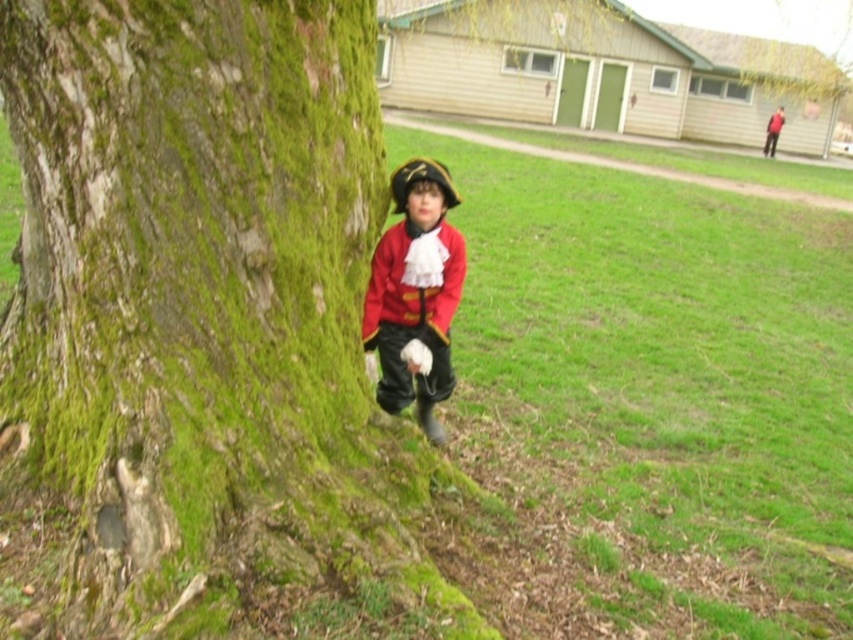
Based on the scene, which object is larger in size between the green mossy bark at left and the matte red coat at center?

The green mossy bark at left is bigger than the matte red coat at center.

You are a fashion designer observing the child in the image. You notice two red items of clothing at the center. How far apart are the matte red coat at center and the matte red jacket at center?

→ The matte red coat at center is 10.60 centimeters from the matte red jacket at center.